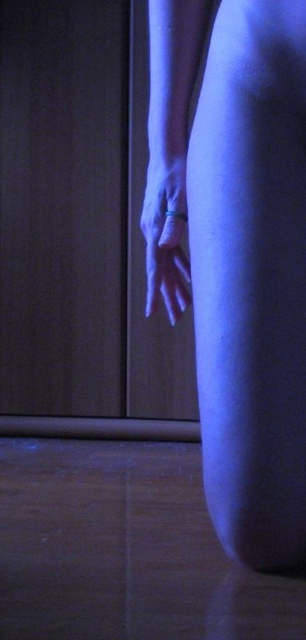
Question: Is smooth skin at center closer to the viewer compared to matte silver ring at lower center?

Choices:
 (A) yes
 (B) no

Answer: (A)

Question: Does smooth skin at center appear on the right side of matte silver ring at lower center?

Choices:
 (A) yes
 (B) no

Answer: (A)

Question: Which point is closer to the camera?

Choices:
 (A) matte silver ring at lower center
 (B) smooth skin at center

Answer: (B)

Question: From the image, what is the correct spatial relationship of smooth skin at center in relation to matte silver ring at lower center?

Choices:
 (A) left
 (B) right

Answer: (B)

Question: Among these objects, which one is farthest from the camera?

Choices:
 (A) matte silver ring at lower center
 (B) smooth skin at center

Answer: (A)

Question: Which object is farther from the camera taking this photo?

Choices:
 (A) smooth skin at center
 (B) matte silver ring at lower center

Answer: (B)